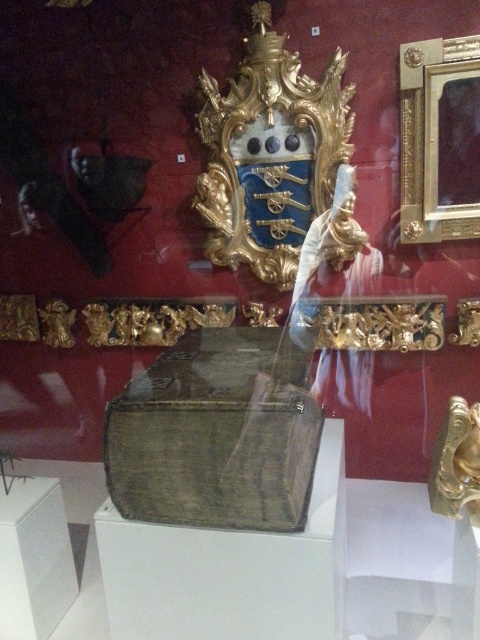
Image resolution: width=480 pixels, height=640 pixels. Find the location of `greenish-brown leather box at center`. greenish-brown leather box at center is located at coordinates (216, 433).

Between point (250, 353) and point (61, 504), which one is positioned behind?

The point (61, 504) is more distant.

Which is behind, point (204, 449) or point (48, 513)?

Point (48, 513)

This screenshot has width=480, height=640. I want to click on greenish-brown leather box at center, so click(216, 433).

Can you confirm if goldmetallicpicture frame at upper right is wider than wooden box at lower left?

Yes.

Can you confirm if goldmetallicpicture frame at upper right is positioned below wooden box at lower left?

Actually, goldmetallicpicture frame at upper right is above wooden box at lower left.

The height and width of the screenshot is (640, 480). What are the coordinates of `goldmetallicpicture frame at upper right` in the screenshot? It's located at (431, 138).

Where is `greenish-brown leather box at center`? greenish-brown leather box at center is located at coordinates (216, 433).

Is point (178, 365) behind point (435, 225)?

No, it is not.

The image size is (480, 640). What do you see at coordinates (216, 433) in the screenshot?
I see `greenish-brown leather box at center` at bounding box center [216, 433].

Image resolution: width=480 pixels, height=640 pixels. Identify the location of greenish-brown leather box at center. (216, 433).